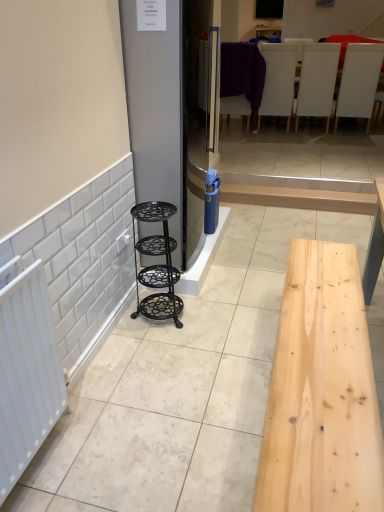
What do you see at coordinates (317, 82) in the screenshot? I see `white matte chair at upper center, positioned as the 3th furniture in back-to-front order` at bounding box center [317, 82].

Describe the element at coordinates (157, 265) in the screenshot. I see `black wrought iron shelf at center left, marked as the 1th furniture in a front-to-back arrangement` at that location.

Where is `satin silver fridge at center`? satin silver fridge at center is located at coordinates (168, 113).

This screenshot has width=384, height=512. What do you see at coordinates (168, 113) in the screenshot?
I see `satin silver fridge at center` at bounding box center [168, 113].

Where is `white leather chairs at upper center, which is the 3th furniture in right-to-left order`? white leather chairs at upper center, which is the 3th furniture in right-to-left order is located at coordinates (278, 81).

From a real-world perspective, which object stands above the other?

white matte radiator at left is physically above.

Is black wrought iron shelf at center left, the 5th furniture viewed from the right, not near white matte radiator at left?

black wrought iron shelf at center left, the 5th furniture viewed from the right, is actually quite close to white matte radiator at left.

Can we say black wrought iron shelf at center left, marked as the 1th furniture in a left-to-right arrangement, lies outside white matte radiator at left?

black wrought iron shelf at center left, marked as the 1th furniture in a left-to-right arrangement, is positioned outside white matte radiator at left.

Is white matte radiator at left further to camera compared to black wrought iron shelf at center left, marked as the 1th furniture in a left-to-right arrangement?

That is False.

How many degrees apart are the facing directions of white matte radiator at left and black wrought iron shelf at center left, marked as the 1th furniture in a front-to-back arrangement?

The angular difference between white matte radiator at left and black wrought iron shelf at center left, marked as the 1th furniture in a front-to-back arrangement, is 1.84 degrees.

Does white matte radiator at left have a greater width compared to black wrought iron shelf at center left, marked as the 1th furniture in a front-to-back arrangement?

In fact, white matte radiator at left might be narrower than black wrought iron shelf at center left, marked as the 1th furniture in a front-to-back arrangement.

Could you tell me if white matte radiator at left is facing black wrought iron shelf at center left, marked as the 1th furniture in a front-to-back arrangement?

No.

Which is in front, point (319, 91) or point (372, 68)?

The point (372, 68) is closer.

Which is in front, white matte chair at upper center, which is counted as the 3th furniture, starting from the front, or white matte chair at upper right, the second furniture when ordered from front to back?

white matte chair at upper right, the second furniture when ordered from front to back.

In the scene shown: Considering the sizes of white matte chair at upper center, the 4th furniture positioned from the left, and white matte chair at upper right, the second furniture when ordered from front to back, in the image, is white matte chair at upper center, the 4th furniture positioned from the left, wider or thinner than white matte chair at upper right, the second furniture when ordered from front to back,?

white matte chair at upper center, the 4th furniture positioned from the left, is wider than white matte chair at upper right, the second furniture when ordered from front to back.

Can you confirm if white matte chair at upper center, which is counted as the 3th furniture, starting from the front, is taller than white matte chair at upper right, which is the 5th furniture from left to right?

No.

How different are the orientations of white matte chair at upper center, which is counted as the 3th furniture, starting from the front, and white matte radiator at left in degrees?

89.9 degrees.

From a real-world perspective, is white matte chair at upper center, the 4th furniture positioned from the left, positioned under white matte radiator at left based on gravity?

No, from a real-world perspective, white matte chair at upper center, the 4th furniture positioned from the left, is not below white matte radiator at left.

Does white matte chair at upper center, positioned as the 2th furniture in right-to-left order, have a greater width compared to white matte radiator at left?

Yes.

Looking at this image, which point is more forward, (303, 109) or (15, 410)?

The point (15, 410) is closer to the camera.

Where is `fridge below the white leather chairs at upper center, which is the 3th furniture from left to right (from the image's perspective)`? fridge below the white leather chairs at upper center, which is the 3th furniture from left to right (from the image's perspective) is located at coordinates (168, 113).

Based on the photo, is satin silver fridge at center in front of or behind white leather chairs at upper center, which is the 3th furniture in right-to-left order, in the image?

Clearly, satin silver fridge at center is in front of white leather chairs at upper center, which is the 3th furniture in right-to-left order.

Is point (193, 27) closer or farther from the camera than point (292, 102)?

Point (193, 27) is positioned closer to the camera compared to point (292, 102).

Does point (12, 474) lie behind point (228, 90)?

No, (12, 474) is in front of (228, 90).

From the image's perspective, is white matte radiator at left below purple fabric chair at upper center, the first furniture from the back?

Indeed, from the image's perspective, white matte radiator at left is shown beneath purple fabric chair at upper center, the first furniture from the back.

From a real-world perspective, is white matte radiator at left beneath purple fabric chair at upper center, which appears as the fifth furniture when viewed from the front?

Indeed, from a real-world perspective, white matte radiator at left is positioned beneath purple fabric chair at upper center, which appears as the fifth furniture when viewed from the front.

In the scene shown: From their relative heights in the image, would you say white matte chair at upper center, which is counted as the 3th furniture, starting from the front, is taller or shorter than black wrought iron shelf at center left, marked as the 1th furniture in a front-to-back arrangement?

Clearly, white matte chair at upper center, which is counted as the 3th furniture, starting from the front, is taller compared to black wrought iron shelf at center left, marked as the 1th furniture in a front-to-back arrangement.

From a real-world perspective, relative to black wrought iron shelf at center left, marked as the 1th furniture in a front-to-back arrangement, is white matte chair at upper center, positioned as the 3th furniture in back-to-front order, vertically above or below?

Clearly, from a real-world perspective, white matte chair at upper center, positioned as the 3th furniture in back-to-front order, is above black wrought iron shelf at center left, marked as the 1th furniture in a front-to-back arrangement.

Between point (318, 98) and point (175, 212), which one is positioned in front?

The point (175, 212) is closer to the camera.

Can you confirm if white matte chair at upper center, which is counted as the 3th furniture, starting from the front, is smaller than black wrought iron shelf at center left, arranged as the 5th furniture when viewed from the back?

Actually, white matte chair at upper center, which is counted as the 3th furniture, starting from the front, might be larger than black wrought iron shelf at center left, arranged as the 5th furniture when viewed from the back.

Where is `radiator lying on the left of black wrought iron shelf at center left, marked as the 1th furniture in a front-to-back arrangement`? radiator lying on the left of black wrought iron shelf at center left, marked as the 1th furniture in a front-to-back arrangement is located at coordinates (26, 369).

Starting from the white matte radiator at left, which furniture is the 1st one behind? Please provide its 2D coordinates.

[(157, 265)]

Consider the image. When comparing their distances from white leather chairs at upper center, which appears as the second furniture when viewed from the back, does black wrought iron shelf at center left, arranged as the 5th furniture when viewed from the back, or white matte chair at upper center, positioned as the 3th furniture in back-to-front order, seem closer?

white matte chair at upper center, positioned as the 3th furniture in back-to-front order.

Considering their positions, is white matte chair at upper right, which is the 5th furniture from left to right, positioned closer to white matte radiator at left than white matte chair at upper center, the 4th furniture positioned from the left?

white matte chair at upper center, the 4th furniture positioned from the left, lies closer to white matte radiator at left than the other object.

From the image, which object appears to be farther from white matte chair at upper center, positioned as the 3th furniture in back-to-front order, purple fabric chair at upper center, the first furniture from the back, or satin silver fridge at center?

satin silver fridge at center lies further to white matte chair at upper center, positioned as the 3th furniture in back-to-front order, than the other object.

Which object lies nearer to the anchor point white matte chair at upper right, the fourth furniture from the back, satin silver fridge at center or white matte radiator at left?

Among the two, satin silver fridge at center is located nearer to white matte chair at upper right, the fourth furniture from the back.

Which object lies nearer to the anchor point white leather chairs at upper center, which appears as the second furniture when viewed from the back, white matte chair at upper right, the second furniture when ordered from front to back, or satin silver fridge at center?

white matte chair at upper right, the second furniture when ordered from front to back, is closer to white leather chairs at upper center, which appears as the second furniture when viewed from the back.

When comparing their distances from white matte chair at upper right, which ranks as the first furniture in right-to-left order, does white leather chairs at upper center, which is the 3th furniture in right-to-left order, or white matte chair at upper center, positioned as the 2th furniture in right-to-left order, seem further?

The object further to white matte chair at upper right, which ranks as the first furniture in right-to-left order, is white leather chairs at upper center, which is the 3th furniture in right-to-left order.

Based on the photo, considering their positions, is black wrought iron shelf at center left, marked as the 1th furniture in a front-to-back arrangement, positioned further to white matte chair at upper center, positioned as the 3th furniture in back-to-front order, than purple fabric chair at upper center, the first furniture from the back?

black wrought iron shelf at center left, marked as the 1th furniture in a front-to-back arrangement.

Considering their positions, is satin silver fridge at center positioned closer to purple fabric chair at upper center, the second furniture when ordered from left to right, than black wrought iron shelf at center left, marked as the 1th furniture in a left-to-right arrangement?

Based on the image, satin silver fridge at center appears to be nearer to purple fabric chair at upper center, the second furniture when ordered from left to right.

Image resolution: width=384 pixels, height=512 pixels. Identify the location of furniture between purple fabric chair at upper center, which appears as the fifth furniture when viewed from the front, and white matte chair at upper center, positioned as the 3th furniture in back-to-front order. (278, 81).

This screenshot has height=512, width=384. I want to click on fridge between white matte radiator at left and white matte chair at upper right, the second furniture when ordered from front to back, in the front-back direction, so click(168, 113).

At what (x,y) coordinates should I click in order to perform the action: click on furniture positioned between satin silver fridge at center and white matte chair at upper right, which ranks as the first furniture in right-to-left order, from near to far. Please return your answer as a coordinate pair (x, y). Looking at the image, I should click on (157, 265).

Identify the location of furniture between satin silver fridge at center and white matte radiator at left in the up-down direction. (157, 265).